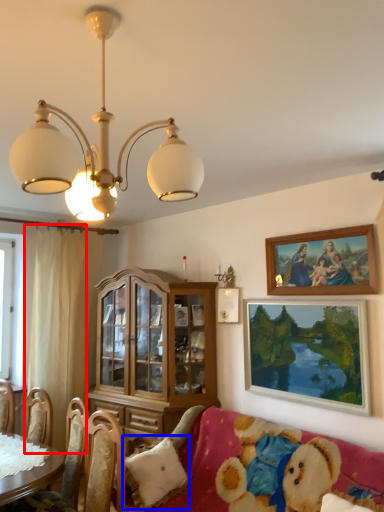
Question: Among these objects, which one is farthest to the camera, curtain (highlighted by a red box) or pillow (highlighted by a blue box)?

Choices:
 (A) curtain
 (B) pillow

Answer: (A)